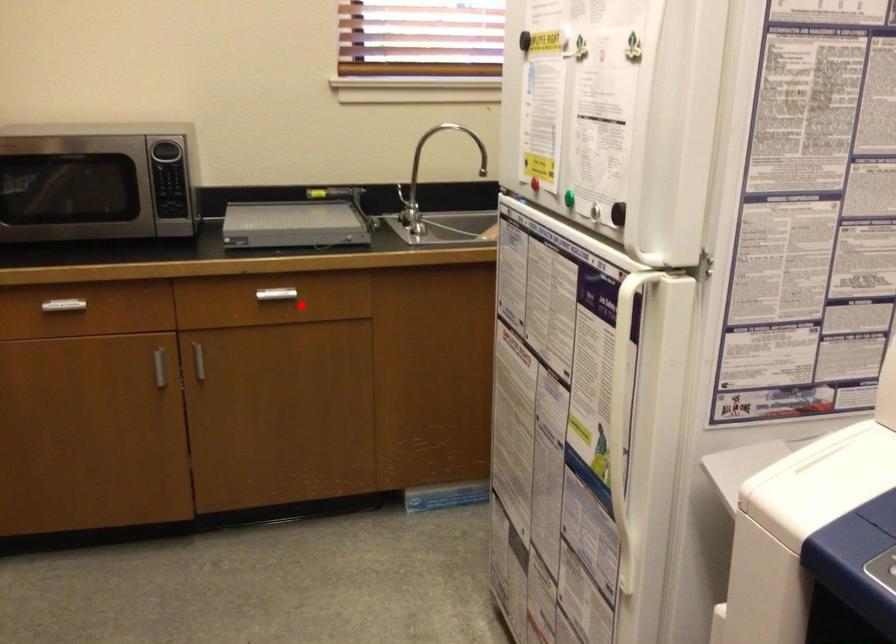
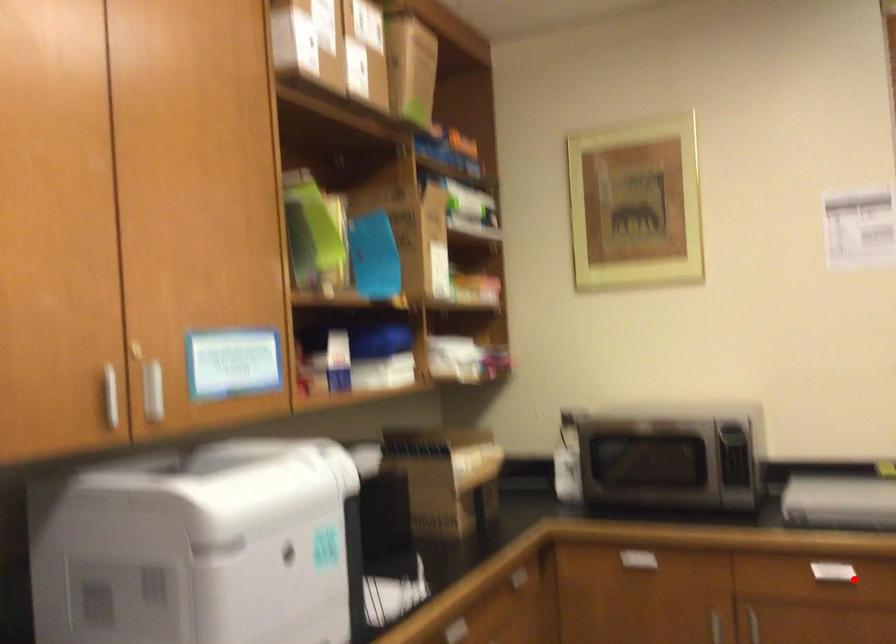
I am providing you with two images of the same scene from different viewpoints. A red point is marked on the first image and another point is marked on the second image. Is the red point in image1 aligned with the point shown in image2?

Yes